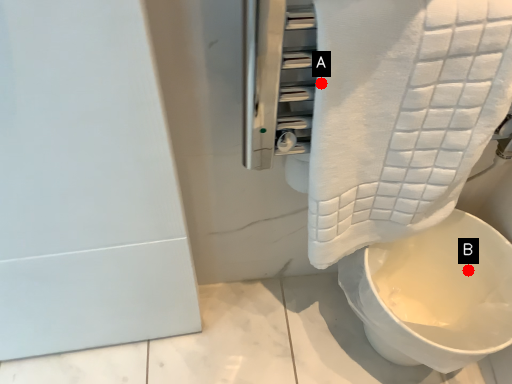
Question: Two points are circled on the image, labeled by A and B beside each circle. Which point appears closest to the camera in this image?

Choices:
 (A) A is closer
 (B) B is closer

Answer: (A)